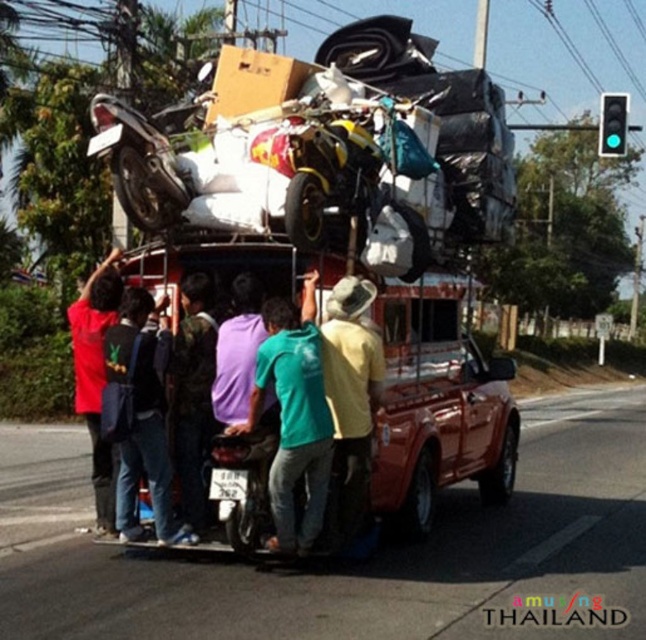
What are the coordinates of the red matte truck at center?

The coordinates of the red matte truck at center are at point (x=344, y=397).

You are standing at the point labeled point (326, 154) in the image. What object are you touching?

The point (326, 154) is on the yellow matte motorcycle at center, so you are touching the yellow matte motorcycle at center.